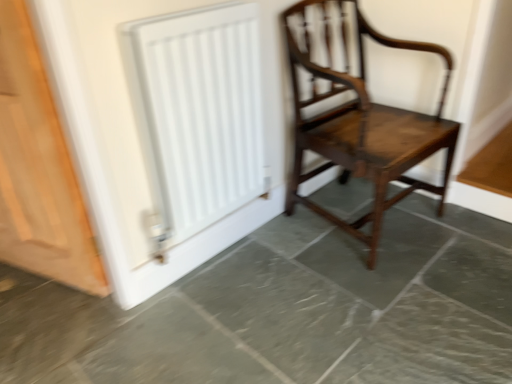
Identify the location of mahogany wooden chair at center. The width and height of the screenshot is (512, 384). (358, 113).

Locate an element on the screen. gray marble floor at center is located at coordinates (287, 311).

Does light brown wood door at left have a lesser height compared to white matte radiator at upper left?

Incorrect, the height of light brown wood door at left does not fall short of that of white matte radiator at upper left.

Looking at this image, from the image's perspective, which is below, light brown wood door at left or white matte radiator at upper left?

light brown wood door at left.

Can you confirm if light brown wood door at left is thinner than white matte radiator at upper left?

No, light brown wood door at left is not thinner than white matte radiator at upper left.

Is white matte radiator at upper left facing away from light brown wood door at left?

No.

Considering the positions of points (258, 85) and (45, 186), is point (258, 85) farther from camera compared to point (45, 186)?

That is True.

From the picture: From their relative heights in the image, would you say white matte radiator at upper left is taller or shorter than light brown wood door at left?

In the image, white matte radiator at upper left appears to be shorter than light brown wood door at left.

Considering the sizes of white matte radiator at upper left and light brown wood door at left in the image, is white matte radiator at upper left wider or thinner than light brown wood door at left?

In the image, white matte radiator at upper left appears to be more narrow than light brown wood door at left.

From a real-world perspective, between white matte radiator at upper left and mahogany wooden chair at center, who is vertically lower?

mahogany wooden chair at center.

Is white matte radiator at upper left wider than mahogany wooden chair at center?

In fact, white matte radiator at upper left might be narrower than mahogany wooden chair at center.

Find the location of a particular element. This screenshot has height=384, width=512. chair above the white matte radiator at upper left (from the image's perspective) is located at coordinates pos(358,113).

Does white matte radiator at upper left have a greater height compared to mahogany wooden chair at center?

Incorrect, the height of white matte radiator at upper left is not larger of that of mahogany wooden chair at center.

In the scene shown: Between gray marble floor at center and mahogany wooden chair at center, which one has larger size?

With larger size is mahogany wooden chair at center.

Consider the image. Is gray marble floor at center not near mahogany wooden chair at center?

That's not correct — gray marble floor at center is a little close to mahogany wooden chair at center.

Can you confirm if gray marble floor at center is wider than mahogany wooden chair at center?

Indeed, gray marble floor at center has a greater width compared to mahogany wooden chair at center.

Does point (500, 233) come behind point (415, 120)?

That is True.

From the image's perspective, between light brown wood door at left and mahogany wooden chair at center, which one is located above?

mahogany wooden chair at center appears higher in the image.

Which is closer to the camera, (26,128) or (426,142)?

Point (26,128) is closer to the camera than point (426,142).

Does light brown wood door at left have a lesser width compared to mahogany wooden chair at center?

Yes.

Is gray marble floor at center outside of light brown wood door at left?

Yes.

In terms of height, does gray marble floor at center look taller or shorter compared to light brown wood door at left?

Clearly, gray marble floor at center is shorter compared to light brown wood door at left.

Is gray marble floor at center smaller than light brown wood door at left?

No, gray marble floor at center is not smaller than light brown wood door at left.

Who is smaller, light brown wood door at left or gray marble floor at center?

light brown wood door at left.

Is light brown wood door at left aimed at gray marble floor at center?

No.

Is light brown wood door at left far away from gray marble floor at center?

No.

Which of these two, light brown wood door at left or gray marble floor at center, stands shorter?

With less height is gray marble floor at center.

Locate an element on the screen. radiator on the right of the light brown wood door at left is located at coordinates (198, 112).

You are a GUI agent. You are given a task and a screenshot of the screen. Output one action in this format:
    pyautogui.click(x=<x>, y=<y>)
    Task: Click on the radiator above the light brown wood door at left (from a real-world perspective)
    
    Given the screenshot: What is the action you would take?
    pyautogui.click(x=198, y=112)

Estimate the real-world distances between objects in this image. Which object is further from white matte radiator at upper left, gray marble floor at center or mahogany wooden chair at center?

Based on the image, gray marble floor at center appears to be further to white matte radiator at upper left.

Which object lies nearer to the anchor point mahogany wooden chair at center, white matte radiator at upper left or light brown wood door at left?

white matte radiator at upper left lies closer to mahogany wooden chair at center than the other object.

Estimate the real-world distances between objects in this image. Which object is further from light brown wood door at left, white matte radiator at upper left or gray marble floor at center?

gray marble floor at center.

When comparing their distances from mahogany wooden chair at center, does gray marble floor at center or light brown wood door at left seem further?

Among the two, light brown wood door at left is located further to mahogany wooden chair at center.

Which object lies further to the anchor point gray marble floor at center, mahogany wooden chair at center or white matte radiator at upper left?

Among the two, white matte radiator at upper left is located further to gray marble floor at center.

Based on their spatial positions, is white matte radiator at upper left or mahogany wooden chair at center further from light brown wood door at left?

mahogany wooden chair at center is positioned further to the anchor light brown wood door at left.

Considering their positions, is mahogany wooden chair at center positioned closer to white matte radiator at upper left than gray marble floor at center?

mahogany wooden chair at center lies closer to white matte radiator at upper left than the other object.

When comparing their distances from white matte radiator at upper left, does mahogany wooden chair at center or light brown wood door at left seem closer?

light brown wood door at left lies closer to white matte radiator at upper left than the other object.

The image size is (512, 384). What are the coordinates of `radiator that lies between mahogany wooden chair at center and gray marble floor at center from top to bottom` in the screenshot? It's located at (198, 112).

Find the location of a particular element. The image size is (512, 384). radiator between light brown wood door at left and gray marble floor at center from left to right is located at coordinates (198, 112).

At what (x,y) coordinates should I click in order to perform the action: click on radiator between light brown wood door at left and mahogany wooden chair at center from left to right. Please return your answer as a coordinate pair (x, y). The image size is (512, 384). Looking at the image, I should click on (198, 112).

Image resolution: width=512 pixels, height=384 pixels. I want to click on concrete between light brown wood door at left and mahogany wooden chair at center in the horizontal direction, so click(287, 311).